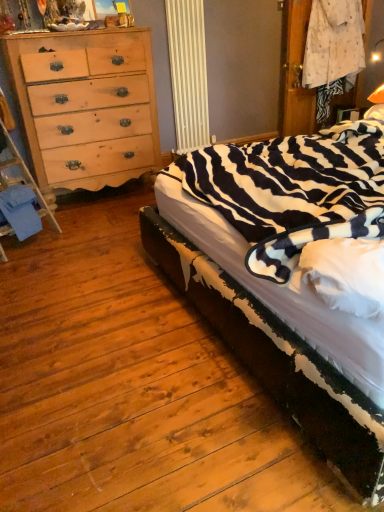
Question: Is blue fabric at lower left turned away from natural wood dresser at left?

Choices:
 (A) yes
 (B) no

Answer: (B)

Question: Considering the relative sizes of blue fabric at lower left and natural wood dresser at left in the image provided, is blue fabric at lower left shorter than natural wood dresser at left?

Choices:
 (A) no
 (B) yes

Answer: (B)

Question: Are blue fabric at lower left and natural wood dresser at left located far from each other?

Choices:
 (A) no
 (B) yes

Answer: (A)

Question: Is the depth of blue fabric at lower left less than that of natural wood dresser at left?

Choices:
 (A) yes
 (B) no

Answer: (A)

Question: Can you see blue fabric at lower left touching natural wood dresser at left?

Choices:
 (A) no
 (B) yes

Answer: (A)

Question: From a real-world perspective, is blue fabric at lower left on top of natural wood dresser at left?

Choices:
 (A) no
 (B) yes

Answer: (A)

Question: Would you say zebra-patterned fabric at right is a long distance from blue fabric at lower left?

Choices:
 (A) yes
 (B) no

Answer: (A)

Question: Does zebra-patterned fabric at right have a greater height compared to blue fabric at lower left?

Choices:
 (A) yes
 (B) no

Answer: (A)

Question: Is zebra-patterned fabric at right positioned with its back to blue fabric at lower left?

Choices:
 (A) yes
 (B) no

Answer: (B)

Question: Is zebra-patterned fabric at right thinner than blue fabric at lower left?

Choices:
 (A) yes
 (B) no

Answer: (B)

Question: Considering the relative sizes of zebra-patterned fabric at right and blue fabric at lower left in the image provided, is zebra-patterned fabric at right smaller than blue fabric at lower left?

Choices:
 (A) yes
 (B) no

Answer: (B)

Question: Is blue fabric at lower left surrounded by zebra-patterned fabric at right?

Choices:
 (A) no
 (B) yes

Answer: (A)

Question: Does zebra-patterned fabric at right come in front of natural wood dresser at left?

Choices:
 (A) yes
 (B) no

Answer: (A)